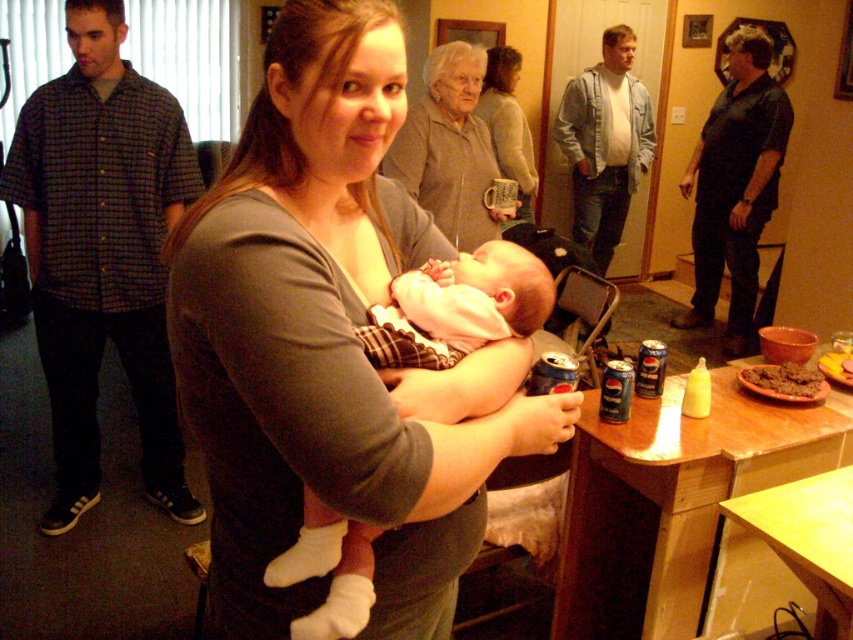
You are a photographer trying to capture a candid shot of the matte gray sweater at center. You need to know its exact location in the scene to frame the shot properly. Where exactly is the matte gray sweater located?

The matte gray sweater at center is located at point coordinates of 0.233 on the x axis and 0.528 on the y axis.

You are organizing a photo shoot and need to ensure that the matte gray shirt at center and the white soft fabric baby at center fit within a rectangular frame. Given that the frame can only accommodate objects up to the size of the larger object, which object determines the minimum required frame size?

The matte gray shirt at center determines the minimum required frame size because its width is larger than the white soft fabric baby at center.

You are standing at the point marked by the coordinates point (268, 634). You want to reach the door located at the opposite end of the room. If you take a step forward, will you move closer to the door or farther away?

Since the point (268, 634) is 36.29 inches away from the viewer, stepping forward would move you closer to the door located at the opposite end of the room.